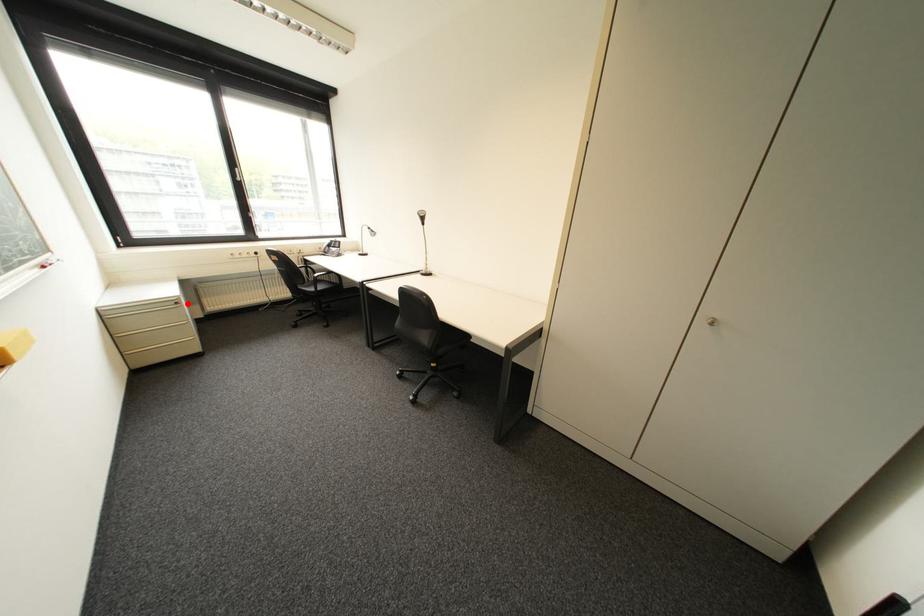
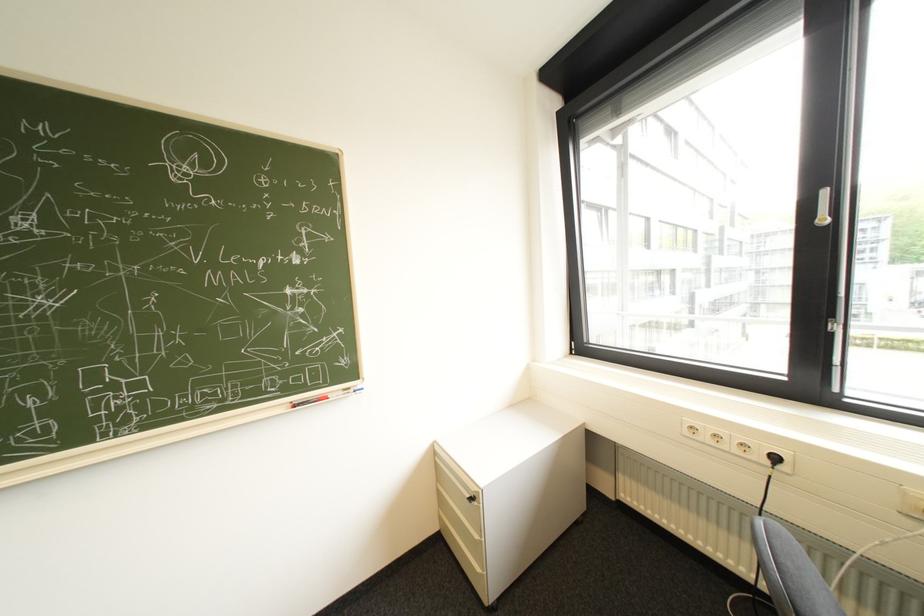
The point at the highlighted location is marked in the first image. Where is the corresponding point in the second image?

(482, 499)